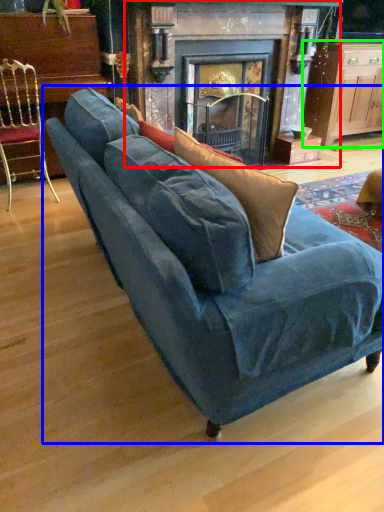
Question: Based on their relative distances, which object is nearer to fireplace (highlighted by a red box)? Choose from studio couch (highlighted by a blue box) and table (highlighted by a green box).

Choices:
 (A) studio couch
 (B) table

Answer: (B)